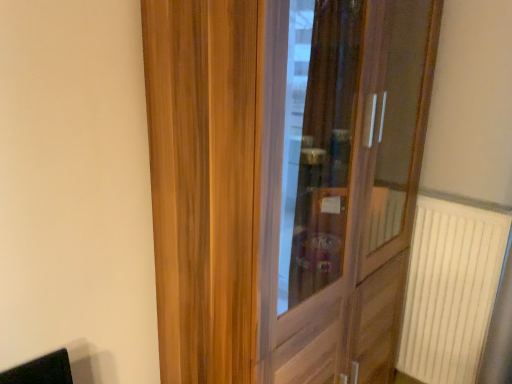
Question: From the image's perspective, would you say wooden door at center is positioned over white plastic radiator at right?

Choices:
 (A) yes
 (B) no

Answer: (A)

Question: Does wooden door at center have a lesser height compared to white plastic radiator at right?

Choices:
 (A) yes
 (B) no

Answer: (B)

Question: Does wooden door at center contain white plastic radiator at right?

Choices:
 (A) yes
 (B) no

Answer: (B)

Question: From a real-world perspective, does wooden door at center stand above white plastic radiator at right?

Choices:
 (A) no
 (B) yes

Answer: (B)

Question: Considering the relative positions of wooden door at center and white plastic radiator at right in the image provided, is wooden door at center to the left of white plastic radiator at right from the viewer's perspective?

Choices:
 (A) yes
 (B) no

Answer: (A)

Question: Does wooden door at center have a larger size compared to white plastic radiator at right?

Choices:
 (A) yes
 (B) no

Answer: (A)

Question: Is white plastic radiator at right located outside wooden door at center?

Choices:
 (A) no
 (B) yes

Answer: (B)

Question: Considering the relative positions of white plastic radiator at right and wooden door at center in the image provided, is white plastic radiator at right in front of wooden door at center?

Choices:
 (A) no
 (B) yes

Answer: (A)

Question: Is white plastic radiator at right to the right of wooden door at center from the viewer's perspective?

Choices:
 (A) no
 (B) yes

Answer: (B)

Question: Does white plastic radiator at right have a greater width compared to wooden door at center?

Choices:
 (A) no
 (B) yes

Answer: (A)

Question: From a real-world perspective, is white plastic radiator at right over wooden door at center?

Choices:
 (A) yes
 (B) no

Answer: (B)

Question: Is white plastic radiator at right beside wooden door at center?

Choices:
 (A) yes
 (B) no

Answer: (B)

Question: From a real-world perspective, is wooden door at center positioned above or below white plastic radiator at right?

Choices:
 (A) above
 (B) below

Answer: (A)